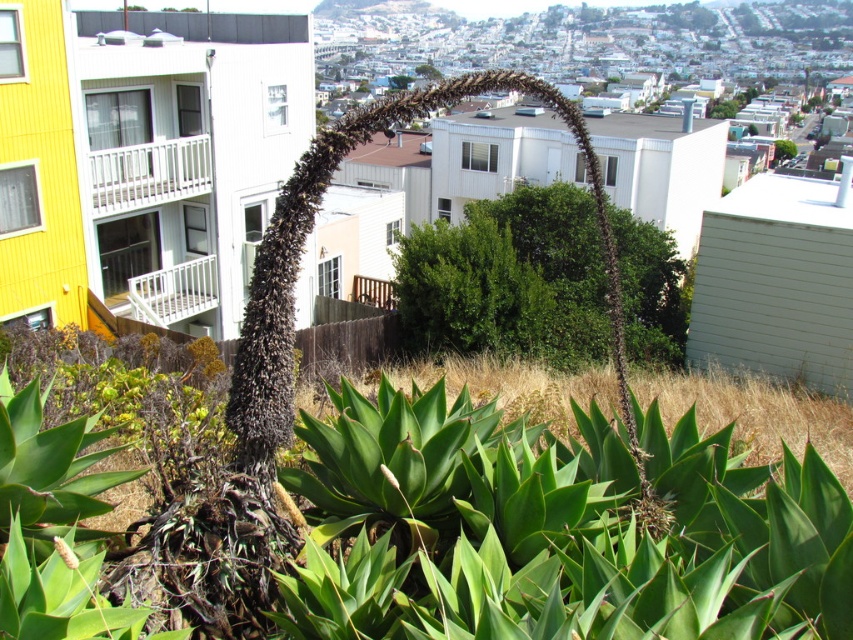
Question: Does green leafy bush at center appear on the left side of green leafy tree at upper center?

Choices:
 (A) no
 (B) yes

Answer: (A)

Question: Which of the following is the farthest from the observer?

Choices:
 (A) (581, 259)
 (B) (790, 140)

Answer: (B)

Question: Which point is farther to the camera?

Choices:
 (A) (643, 227)
 (B) (422, 67)

Answer: (B)

Question: Can you confirm if green leafy tree at upper right is positioned below green leafy tree at upper center?

Choices:
 (A) yes
 (B) no

Answer: (A)

Question: Which of the following is the closest to the observer?

Choices:
 (A) [784, 156]
 (B) [506, 262]
 (C) [428, 67]

Answer: (B)

Question: Can you confirm if green leafy tree at upper right is thinner than green leafy tree at upper center?

Choices:
 (A) no
 (B) yes

Answer: (B)